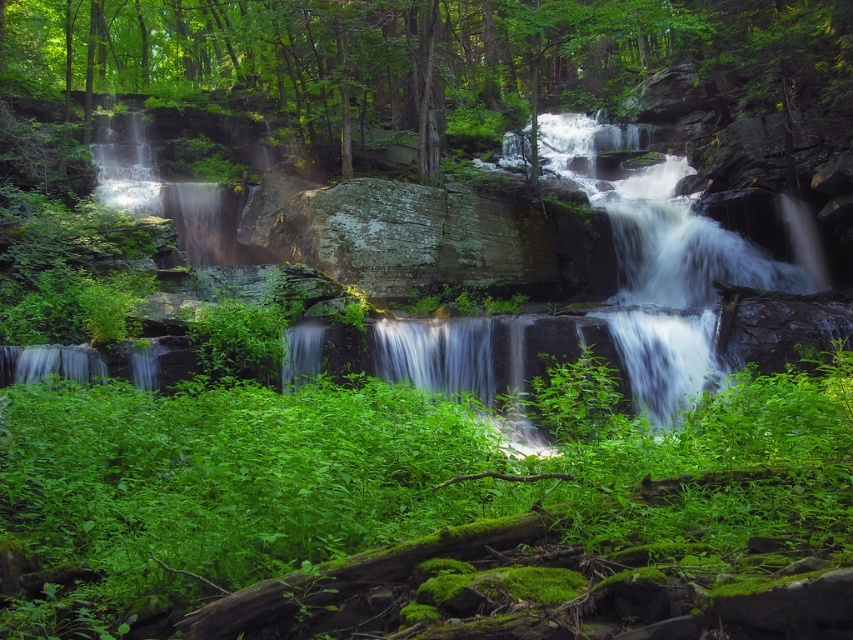
Is green leafy plants at center positioned at the back of green leafy tree at upper center?

That is False.

Who is positioned more to the right, green leafy plants at center or green leafy tree at upper center?

green leafy plants at center

Does point (683, 480) come farther from viewer compared to point (363, 120)?

No, (683, 480) is in front of (363, 120).

Locate an element on the screen. Image resolution: width=853 pixels, height=640 pixels. green leafy plants at center is located at coordinates (404, 486).